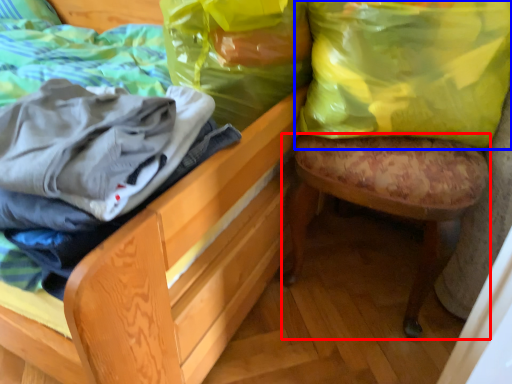
Question: Which of the following is the closest to the observer, stool (highlighted by a red box) or shopping bag (highlighted by a blue box)?

Choices:
 (A) stool
 (B) shopping bag

Answer: (A)